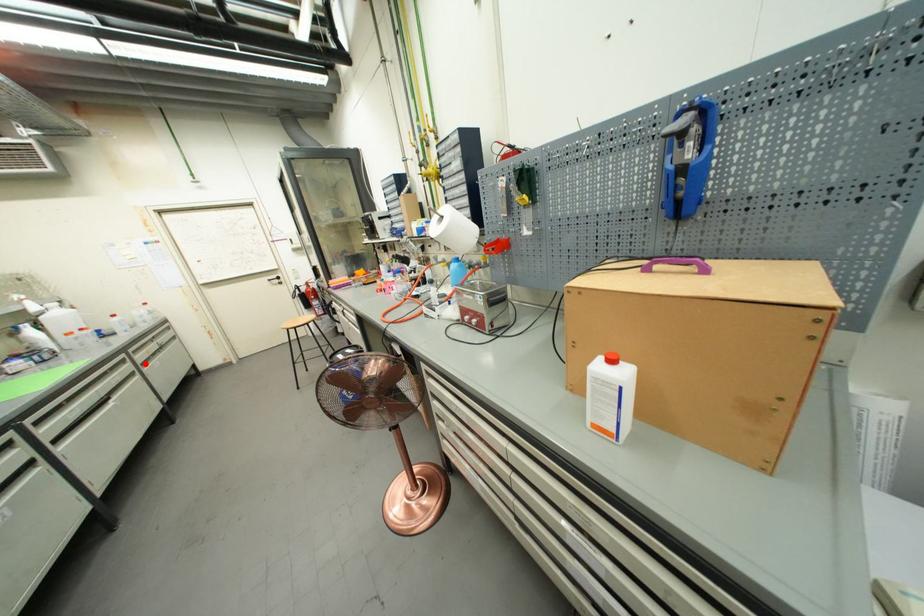
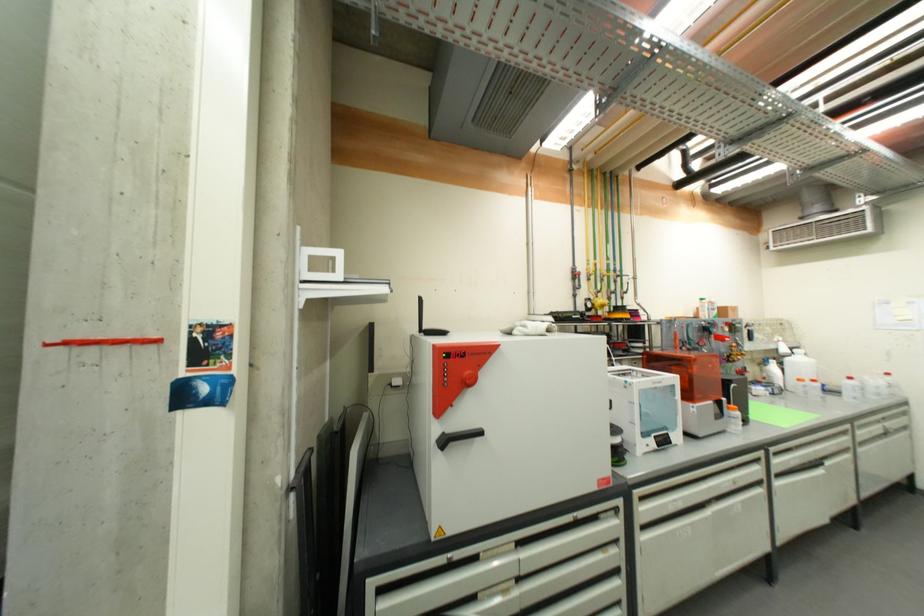
Where in the second image is the point corresponding to the highlighted location from the first image?

(864, 442)